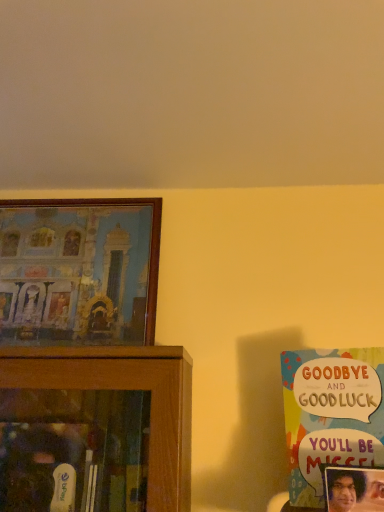
The height and width of the screenshot is (512, 384). Describe the element at coordinates (354, 489) in the screenshot. I see `matte plastic picture frame at lower right, which appears as the first picture frame when viewed from the front` at that location.

Measure the distance between point (108, 222) and camera.

→ Point (108, 222) and camera are 4.18 feet apart from each other.

You are a GUI agent. You are given a task and a screenshot of the screen. Output one action in this format:
    pyautogui.click(x=<x>, y=<y>)
    Task: Click on the multicolored paper card at right
    Image resolution: width=384 pixels, height=512 pixels.
    Given the screenshot: What is the action you would take?
    pyautogui.click(x=331, y=415)

Considering the positions of objects wooden framed painting at left, which appears as the 2th picture frame when ordered from the bottom, and multicolored paper card at right in the image provided, who is behind, wooden framed painting at left, which appears as the 2th picture frame when ordered from the bottom, or multicolored paper card at right?

wooden framed painting at left, which appears as the 2th picture frame when ordered from the bottom, is more distant.

From a real-world perspective, between wooden framed painting at left, which is the 1th picture frame in back-to-front order, and multicolored paper card at right, who is vertically lower?

multicolored paper card at right.

Which of these two, wooden framed painting at left, the first picture frame in the left-to-right sequence, or multicolored paper card at right, stands shorter?

With less height is multicolored paper card at right.

This screenshot has width=384, height=512. I want to click on picture frame lying behind the multicolored paper card at right, so click(x=79, y=271).

Is matte plastic picture frame at lower right, which appears as the first picture frame when viewed from the front, directly adjacent to wooden framed painting at left, which is the 1th picture frame in back-to-front order?

No, matte plastic picture frame at lower right, which appears as the first picture frame when viewed from the front, is not beside wooden framed painting at left, which is the 1th picture frame in back-to-front order.

Considering the sizes of objects matte plastic picture frame at lower right, the 2th picture frame in the left-to-right sequence, and wooden framed painting at left, the first picture frame in the left-to-right sequence, in the image provided, who is thinner, matte plastic picture frame at lower right, the 2th picture frame in the left-to-right sequence, or wooden framed painting at left, the first picture frame in the left-to-right sequence,?

matte plastic picture frame at lower right, the 2th picture frame in the left-to-right sequence, is thinner.

Between matte plastic picture frame at lower right, positioned as the second picture frame in back-to-front order, and wooden framed painting at left, which appears as the 2th picture frame when ordered from the bottom, which one has larger size?

Bigger between the two is wooden framed painting at left, which appears as the 2th picture frame when ordered from the bottom.

Looking at this image, is wooden framed painting at left, which appears as the 2th picture frame when ordered from the bottom, taller than matte plastic picture frame at lower right, acting as the first picture frame starting from the right?

Yes.

Is wooden framed painting at left, arranged as the 1th picture frame when viewed from the top, positioned beyond the bounds of matte plastic picture frame at lower right, positioned as the second picture frame in back-to-front order?

Indeed, wooden framed painting at left, arranged as the 1th picture frame when viewed from the top, is completely outside matte plastic picture frame at lower right, positioned as the second picture frame in back-to-front order.

How far apart are wooden framed painting at left, the 2th picture frame from the right, and matte plastic picture frame at lower right, the 2th picture frame in the left-to-right sequence?

A distance of 31.69 inches exists between wooden framed painting at left, the 2th picture frame from the right, and matte plastic picture frame at lower right, the 2th picture frame in the left-to-right sequence.

Which of these two, matte plastic picture frame at lower right, which appears as the first picture frame when viewed from the front, or multicolored paper card at right, is smaller?

matte plastic picture frame at lower right, which appears as the first picture frame when viewed from the front, is smaller.

Between matte plastic picture frame at lower right, acting as the first picture frame starting from the right, and multicolored paper card at right, which one has larger width?

matte plastic picture frame at lower right, acting as the first picture frame starting from the right.

In the scene shown: Can multicolored paper card at right be found inside matte plastic picture frame at lower right, the first picture frame ordered from the bottom?

That's incorrect, multicolored paper card at right is not inside matte plastic picture frame at lower right, the first picture frame ordered from the bottom.

Between matte plastic picture frame at lower right, acting as the first picture frame starting from the right, and multicolored paper card at right, which one appears on the left side from the viewer's perspective?

From the viewer's perspective, multicolored paper card at right appears more on the left side.

Can matte plastic picture frame at lower right, which appears as the first picture frame when viewed from the front, be found inside multicolored paper card at right?

No, multicolored paper card at right does not contain matte plastic picture frame at lower right, which appears as the first picture frame when viewed from the front.

Does point (322, 434) come behind point (383, 504)?

That is True.

In the scene shown: Does multicolored paper card at right have a greater width compared to matte plastic picture frame at lower right, positioned as the second picture frame in back-to-front order?

No.

Between multicolored paper card at right and matte plastic picture frame at lower right, which appears as the first picture frame when viewed from the front, which one appears on the left side from the viewer's perspective?

From the viewer's perspective, multicolored paper card at right appears more on the left side.

Considering the sizes of objects multicolored paper card at right and wooden framed painting at left, marked as the second picture frame in a front-to-back arrangement, in the image provided, who is thinner, multicolored paper card at right or wooden framed painting at left, marked as the second picture frame in a front-to-back arrangement,?

multicolored paper card at right.

Is point (371, 452) positioned after point (32, 298)?

No.

Is multicolored paper card at right looking in the opposite direction of wooden framed painting at left, the 2th picture frame from the right?

That's not correct — multicolored paper card at right is not looking away from wooden framed painting at left, the 2th picture frame from the right.

Considering the sizes of objects multicolored paper card at right and wooden framed painting at left, which appears as the 2th picture frame when ordered from the bottom, in the image provided, who is smaller, multicolored paper card at right or wooden framed painting at left, which appears as the 2th picture frame when ordered from the bottom,?

multicolored paper card at right.

This screenshot has height=512, width=384. Identify the location of book on the right of the wooden framed painting at left, the first picture frame in the left-to-right sequence. (331, 415).

Where is `picture frame positioned vertically above the matte plastic picture frame at lower right, which appears as the first picture frame when viewed from the front (from a real-world perspective)`? Image resolution: width=384 pixels, height=512 pixels. picture frame positioned vertically above the matte plastic picture frame at lower right, which appears as the first picture frame when viewed from the front (from a real-world perspective) is located at coordinates (79, 271).

When comparing their distances from matte plastic picture frame at lower right, which appears as the first picture frame when viewed from the front, does multicolored paper card at right or wooden framed painting at left, the 2th picture frame from the right, seem closer?

Among the two, multicolored paper card at right is located nearer to matte plastic picture frame at lower right, which appears as the first picture frame when viewed from the front.

Based on their spatial positions, is multicolored paper card at right or matte plastic picture frame at lower right, arranged as the 2th picture frame when viewed from the top, closer to wooden framed painting at left, marked as the second picture frame in a front-to-back arrangement?

Among the two, multicolored paper card at right is located nearer to wooden framed painting at left, marked as the second picture frame in a front-to-back arrangement.

Which object lies nearer to the anchor point wooden framed painting at left, arranged as the 1th picture frame when viewed from the top, matte plastic picture frame at lower right, acting as the first picture frame starting from the right, or multicolored paper card at right?

Among the two, multicolored paper card at right is located nearer to wooden framed painting at left, arranged as the 1th picture frame when viewed from the top.

Estimate the real-world distances between objects in this image. Which object is further from multicolored paper card at right, matte plastic picture frame at lower right, arranged as the 2th picture frame when viewed from the top, or wooden framed painting at left, which is the 1th picture frame in back-to-front order?

wooden framed painting at left, which is the 1th picture frame in back-to-front order, is positioned further to the anchor multicolored paper card at right.

When comparing their distances from matte plastic picture frame at lower right, acting as the first picture frame starting from the right, does wooden framed painting at left, which appears as the 2th picture frame when ordered from the bottom, or multicolored paper card at right seem further?

wooden framed painting at left, which appears as the 2th picture frame when ordered from the bottom, is positioned further to the anchor matte plastic picture frame at lower right, acting as the first picture frame starting from the right.

Considering their positions, is wooden framed painting at left, which is the 1th picture frame in back-to-front order, positioned further to multicolored paper card at right than matte plastic picture frame at lower right, positioned as the second picture frame in back-to-front order?

Based on the image, wooden framed painting at left, which is the 1th picture frame in back-to-front order, appears to be further to multicolored paper card at right.

Identify the location of book between wooden framed painting at left, marked as the second picture frame in a front-to-back arrangement, and matte plastic picture frame at lower right, acting as the first picture frame starting from the right, from left to right. (331, 415).